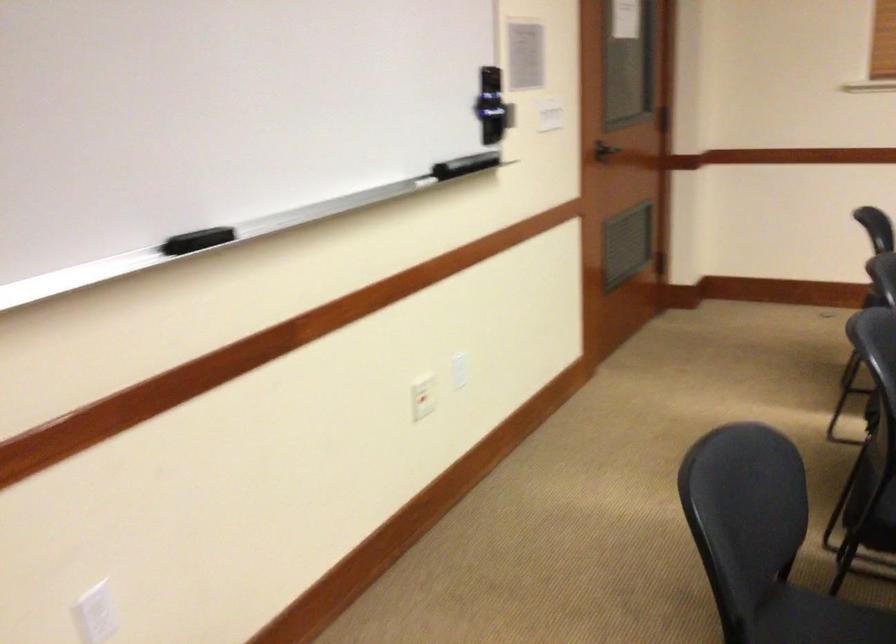
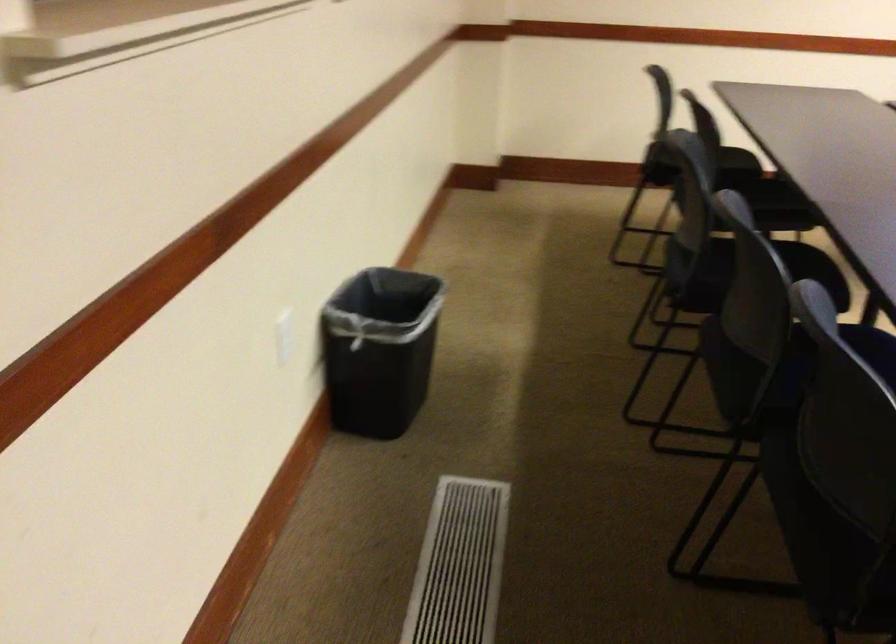
Question: The images are taken continuously from a first-person perspective. In which direction are you moving?

Choices:
 (A) Left
 (B) Right
 (C) Forward
 (D) Backward

Answer: (D)